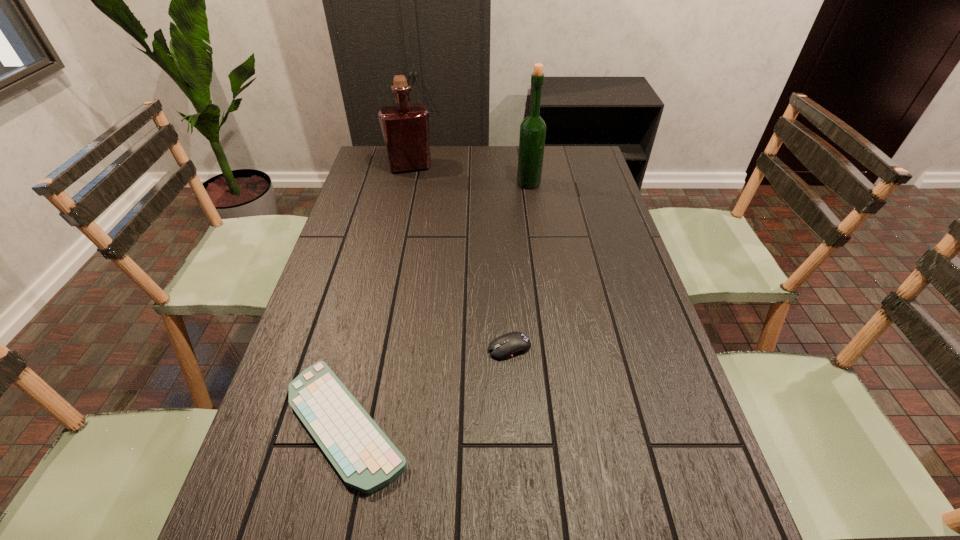
The width and height of the screenshot is (960, 540). What are the coordinates of `vacant space located on the left of the computer equipment` in the screenshot? It's located at (447, 348).

Where is `vacant point located on the back of the shortest object`? vacant point located on the back of the shortest object is located at coordinates (364, 346).

Identify the location of liquor present at the left edge. (405, 127).

This screenshot has height=540, width=960. I want to click on computer keyboard that is at the left edge, so tap(364, 457).

Identify the location of object that is at the far left corner. The height and width of the screenshot is (540, 960). (405, 127).

Locate an element on the screen. vacant area at the far edge of the desktop is located at coordinates (557, 176).

Find the location of `vacant region at the left edge`. vacant region at the left edge is located at coordinates (277, 450).

Image resolution: width=960 pixels, height=540 pixels. In the image, there is a desktop. In order to click on free region at the right edge in this screenshot , I will do `click(627, 258)`.

This screenshot has width=960, height=540. In the image, there is a desktop. What are the coordinates of `vacant space at the far left corner` in the screenshot? It's located at (387, 159).

Locate an element on the screen. blank space at the far right corner is located at coordinates (574, 150).